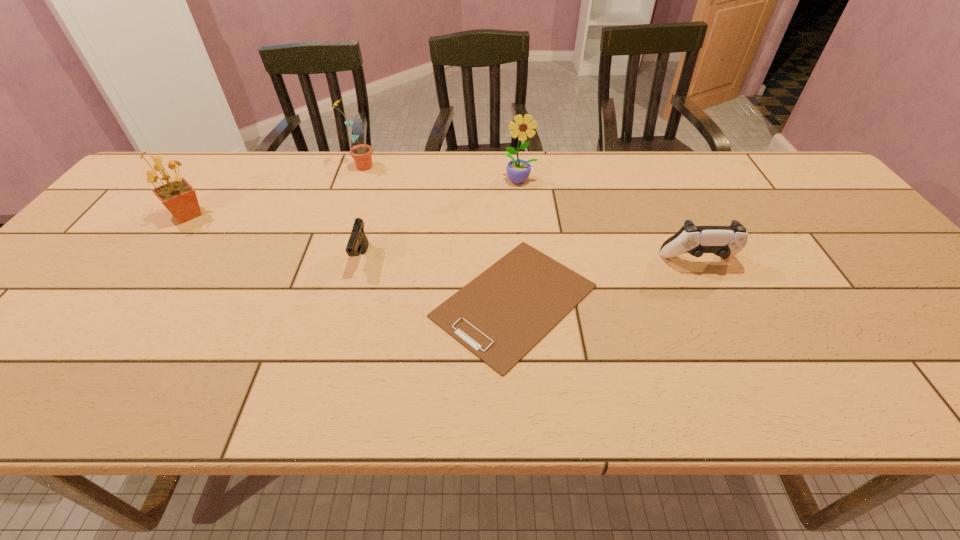
Identify the location of free space between the nearest sunflower and the second sunflower from right to left. Image resolution: width=960 pixels, height=540 pixels. [x=273, y=191].

The width and height of the screenshot is (960, 540). Find the location of `object that is the second closest to the second sunflower from right to left`. object that is the second closest to the second sunflower from right to left is located at coordinates (179, 197).

Where is `object identified as the third closest to the rightmost sunflower`? The height and width of the screenshot is (540, 960). object identified as the third closest to the rightmost sunflower is located at coordinates (362, 154).

You are a GUI agent. You are given a task and a screenshot of the screen. Output one action in this format:
    pyautogui.click(x=<x>, y=<y>)
    Task: Click on the closest sunflower to the shortest object
    This screenshot has height=540, width=960.
    Given the screenshot: What is the action you would take?
    pyautogui.click(x=518, y=170)

Identify which sunflower is located as the nearest to the third farthest object. Please provide its 2D coordinates. Your answer should be formatted as a tuple, i.e. [(x, y)], where the tuple contains the x and y coordinates of a point satisfying the conditions above.

[(362, 154)]

This screenshot has width=960, height=540. In order to click on free space that satisfies the following two spatial constraints: 1. at the barrel of the shortest object; 2. on the left side of the fifth tallest object in this screenshot , I will do `click(350, 301)`.

Where is `vacant region that satisfies the following two spatial constraints: 1. at the barrel of the fifth tallest object; 2. on the right side of the shortest object`? vacant region that satisfies the following two spatial constraints: 1. at the barrel of the fifth tallest object; 2. on the right side of the shortest object is located at coordinates (350, 301).

Where is `free point that satisfies the following two spatial constraints: 1. on the front-facing side of the rightmost sunflower; 2. at the front of the leftmost object with flowers visible`? free point that satisfies the following two spatial constraints: 1. on the front-facing side of the rightmost sunflower; 2. at the front of the leftmost object with flowers visible is located at coordinates (524, 215).

Image resolution: width=960 pixels, height=540 pixels. I want to click on free point that satisfies the following two spatial constraints: 1. on the front-facing side of the rightmost sunflower; 2. at the front of the leftmost sunflower with flowers visible, so click(x=524, y=215).

Identify the location of free point that satisfies the following two spatial constraints: 1. at the front of the leftmost sunflower with flowers visible; 2. on the right side of the clipboard. This screenshot has height=540, width=960. (124, 301).